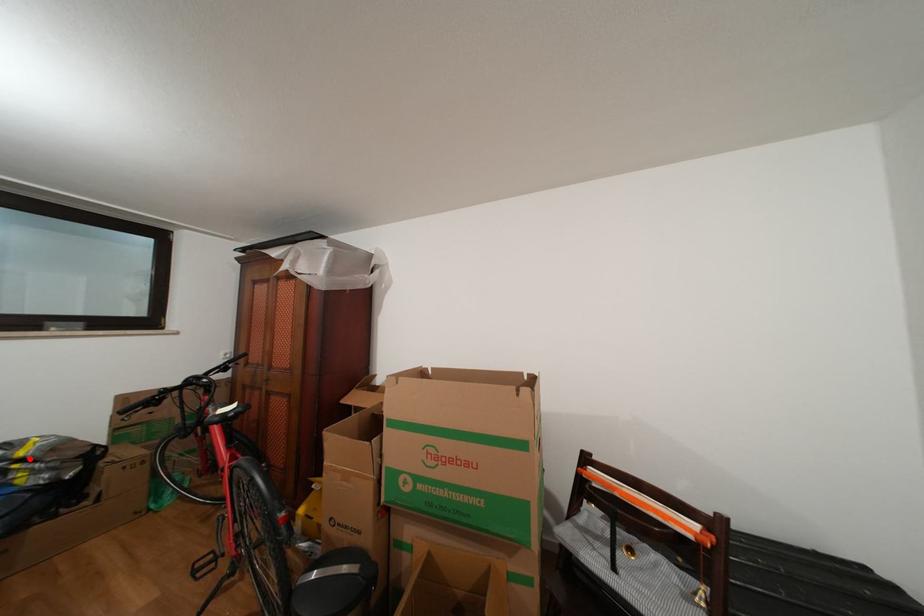
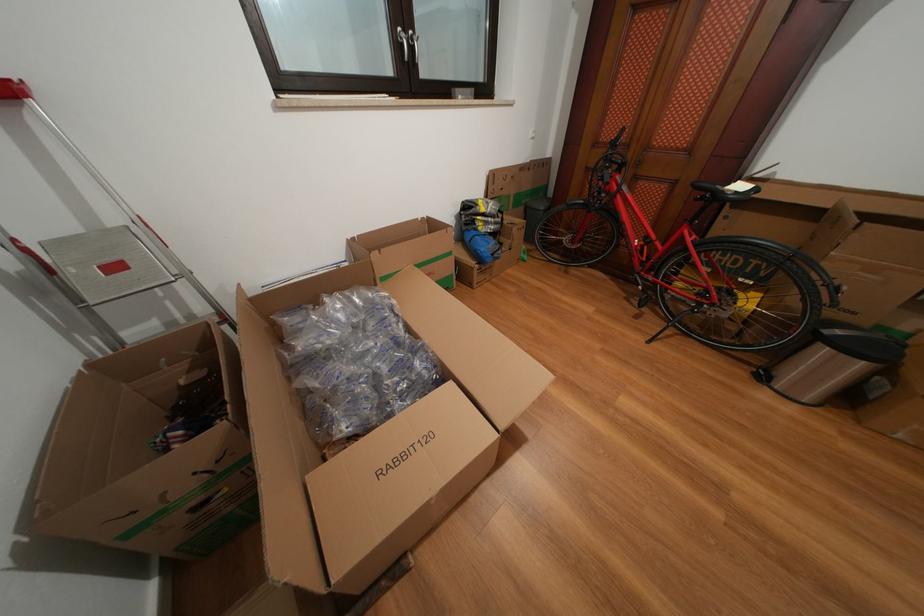
Question: A red point is marked in image1. In image2, is the corresponding 3D point closer to the camera or farther? Reply with the corresponding letter.

Choices:
 (A) The corresponding 3D point is closer.
 (B) The corresponding 3D point is farther.

Answer: (B)